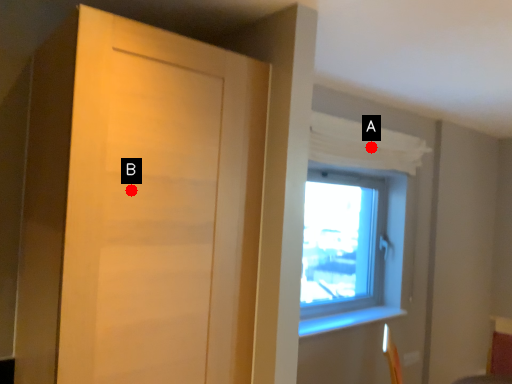
Question: Two points are circled on the image, labeled by A and B beside each circle. Which point is further to the camera?

Choices:
 (A) A is further
 (B) B is further

Answer: (A)